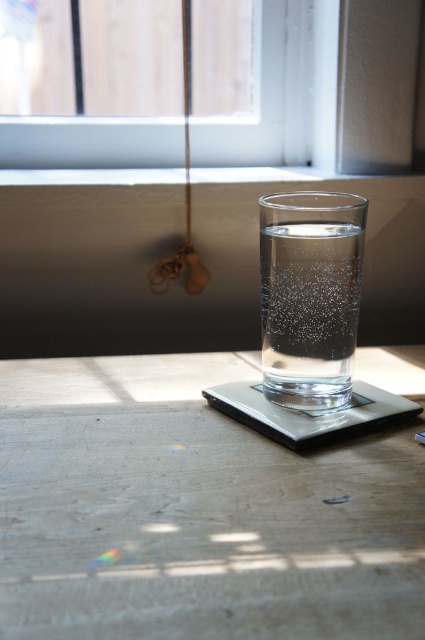
You are a scientist who needs to measure the weight of the clear glass water at center. However, there is a transparent glass window at upper center casting a shadow over the scale. Will the shadow affect the accuracy of the measurement?

The transparent glass window at upper center is located above the clear glass water at center, so its shadow may fall directly on the scale, potentially affecting the measurement accuracy due to temperature changes or obstruction.

Looking at this image, you are trying to reach for the transparent glass table at center and the transparent glass window at upper center. Which one can you physically touch?

The transparent glass table at center is closer to the viewer than the transparent glass window at upper center, so you can physically touch the transparent glass table at center.